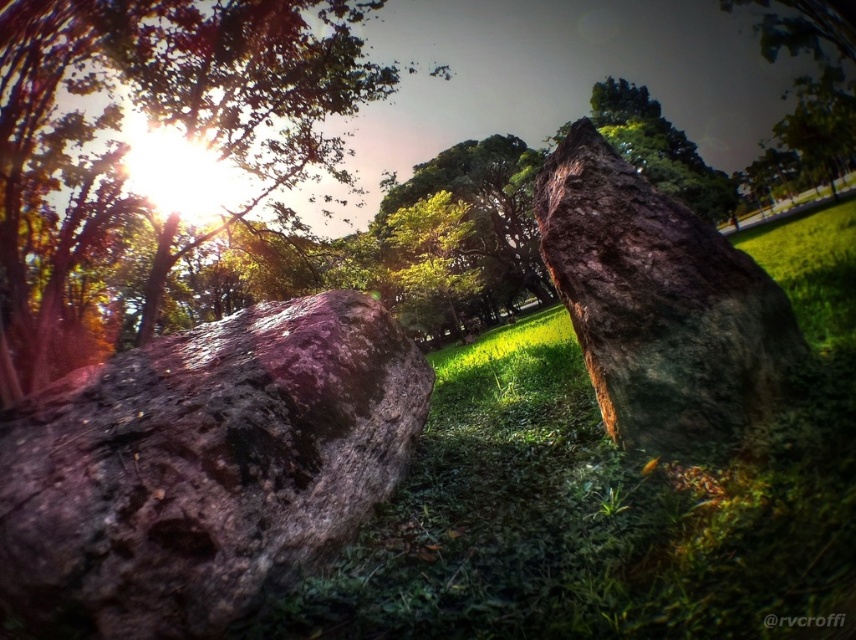
You are a gardener who wants to plant a new flower bed in the green grassy area at center. Considering the height of the green grassy at center compared to the rusty stone boulder at lower left, will the flower bed be more visible from above? Explain your reasoning.

The green grassy at center is much taller than the rusty stone boulder at lower left. Since the grass is taller, the flower bed planted there might be partially hidden by the grass, making it less visible from above compared to if it were placed on the shorter rusty stone boulder at lower left.

From the picture: You are a hiker trying to navigate through the rocks. If you want to reach the smooth brown rock at left, which direction should you move from the rusty stone boulder at lower left?

Since the rusty stone boulder at lower left is closer to the viewer than the smooth brown rock at left, you should move towards the smooth brown rock at left by going away from your current position near the rusty stone boulder at lower left.

You are standing in the outdoor scene and want to place a small flag at the point closer to you between the two points marked as point (409, 438) and point (200, 51). Which point should you choose?

You should choose point (409, 438) because it is closer to the camera than point (200, 51).